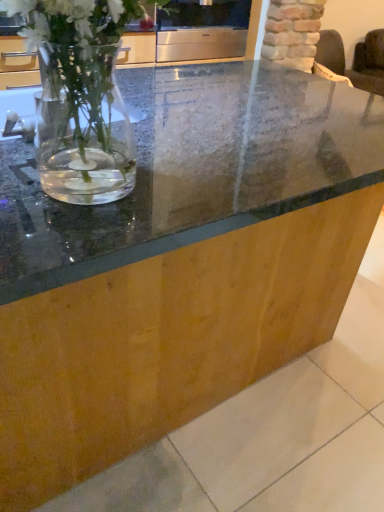
Question: From the image's perspective, is dark brown fabric armchair at upper right above or below satin silver oven at upper center?

Choices:
 (A) below
 (B) above

Answer: (B)

Question: From a real-world perspective, is dark brown fabric armchair at upper right physically located above or below satin silver oven at upper center?

Choices:
 (A) above
 (B) below

Answer: (B)

Question: Considering the positions of dark brown fabric armchair at upper right and satin silver oven at upper center in the image, is dark brown fabric armchair at upper right wider or thinner than satin silver oven at upper center?

Choices:
 (A) wide
 (B) thin

Answer: (A)

Question: Looking at their shapes, would you say satin silver oven at upper center is wider or thinner than dark brown fabric armchair at upper right?

Choices:
 (A) thin
 (B) wide

Answer: (A)

Question: From the image's perspective, is satin silver oven at upper center above or below dark brown fabric armchair at upper right?

Choices:
 (A) above
 (B) below

Answer: (B)

Question: Do you think satin silver oven at upper center is within dark brown fabric armchair at upper right, or outside of it?

Choices:
 (A) inside
 (B) outside

Answer: (B)

Question: From a real-world perspective, is satin silver oven at upper center physically located above or below dark brown fabric armchair at upper right?

Choices:
 (A) above
 (B) below

Answer: (A)